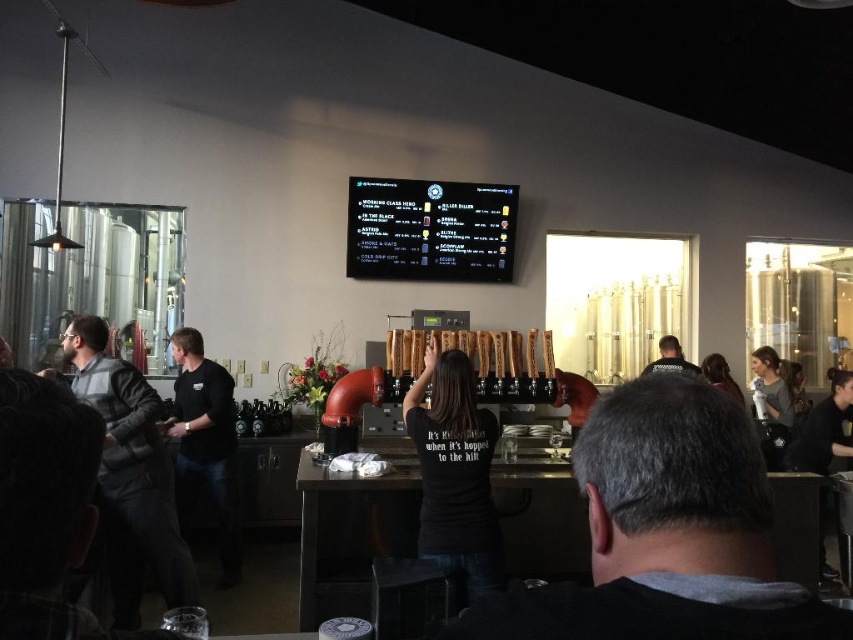
Who is higher up, dark gray sweater at left or dark brown hair at upper right?

dark brown hair at upper right is higher up.

Locate an element on the screen. Image resolution: width=853 pixels, height=640 pixels. dark gray sweater at left is located at coordinates (131, 477).

Who is more distant from viewer, (x=42, y=371) or (x=714, y=360)?

Point (x=714, y=360)

Identify the location of dark gray sweater at left. The width and height of the screenshot is (853, 640). (131, 477).

Is black matte t-shirt at center shorter than wooden stool at lower center?

No.

Is black matte t-shirt at center bigger than wooden stool at lower center?

Yes.

Between point (424, 467) and point (405, 596), which one is positioned behind?

The point (424, 467) is more distant.

Find the location of a particular element. black matte t-shirt at center is located at coordinates (456, 476).

Who is more distant from viewer, (80,323) or (229,561)?

The point (229,561) is behind.

Is point (160, 444) closer to viewer compared to point (189, 401)?

Yes.

Who is more distant from viewer, (109, 532) or (172, 435)?

Positioned behind is point (172, 435).

I want to click on dark gray sweater at left, so click(131, 477).